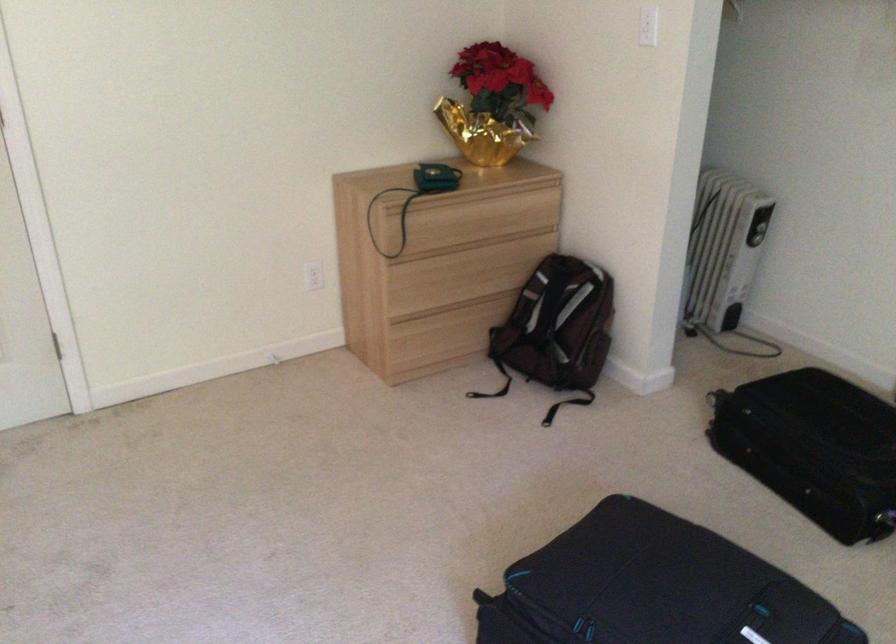
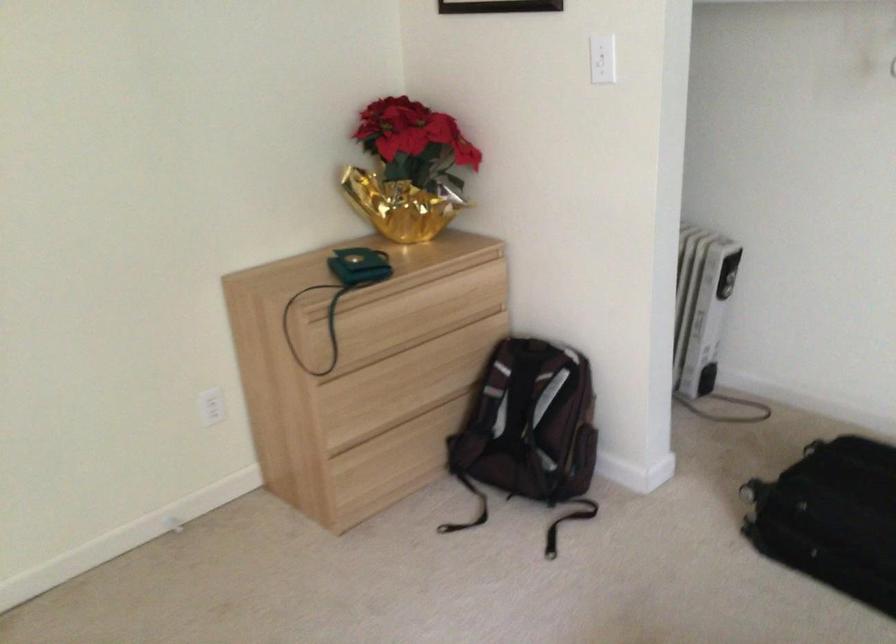
In the second image, find the point that corresponds to (554,325) in the first image.

(531, 427)